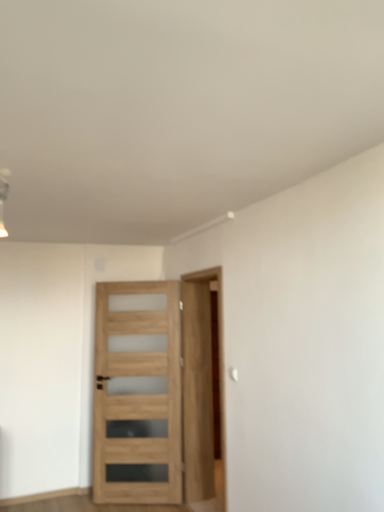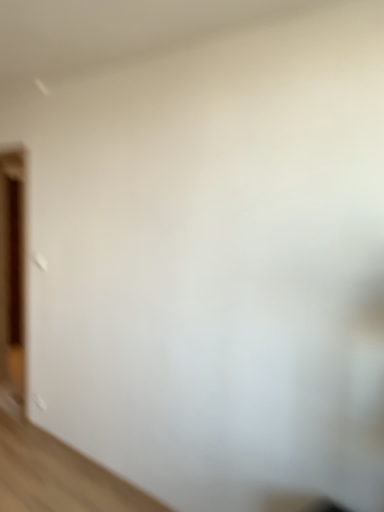
Question: How did the camera likely rotate when shooting the video?

Choices:
 (A) rotated left
 (B) rotated right

Answer: (B)